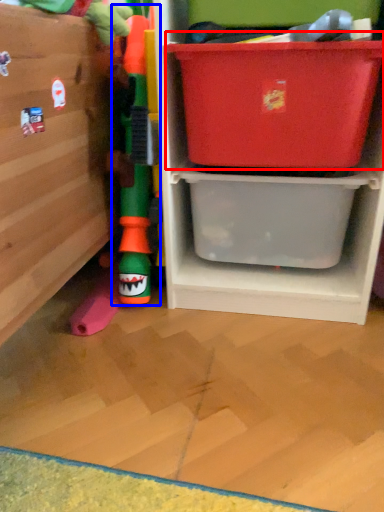
Question: Which object appears farthest to the camera in this image, storage box (highlighted by a red box) or toy (highlighted by a blue box)?

Choices:
 (A) storage box
 (B) toy

Answer: (B)